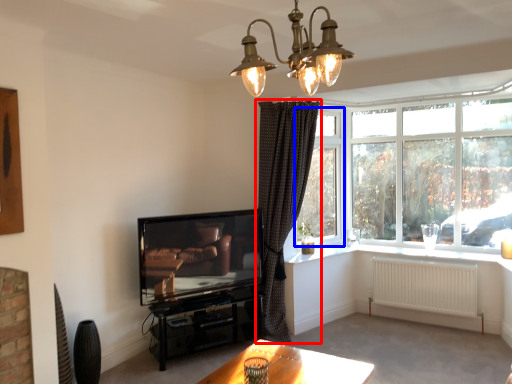
Question: Which object appears closest to the camera in this image, curtain (highlighted by a red box) or window screen (highlighted by a blue box)?

Choices:
 (A) curtain
 (B) window screen

Answer: (A)